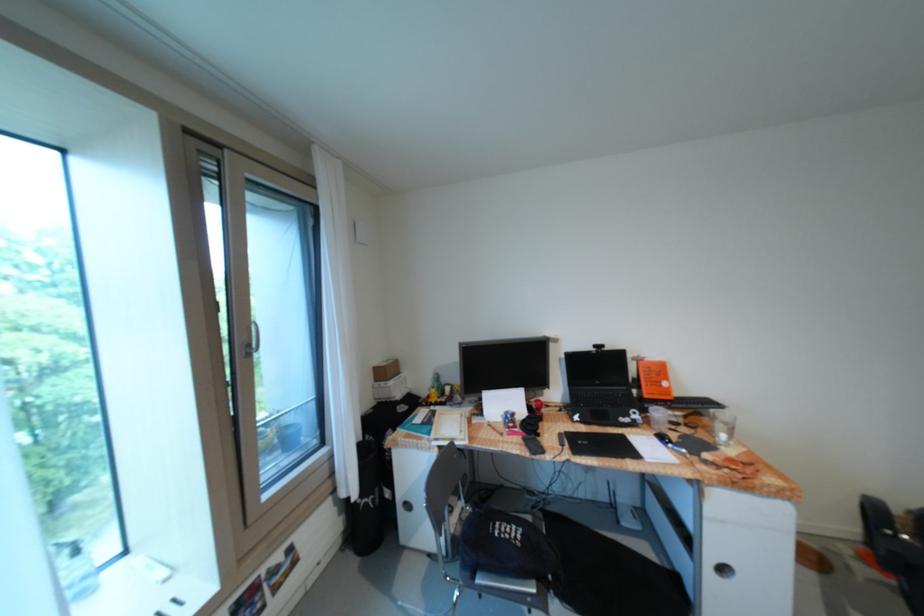
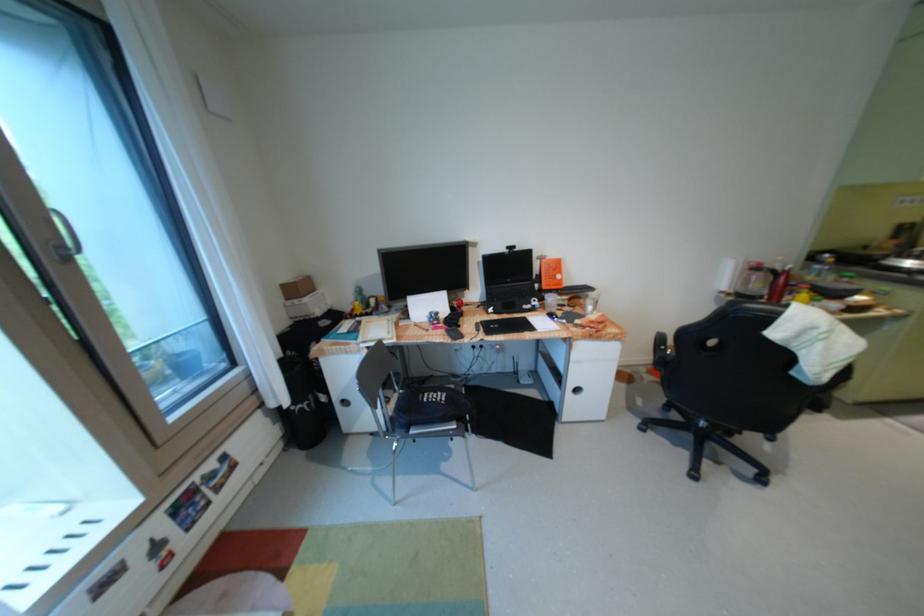
Question: I am providing you with two images of the same scene from different viewpoints. Please identify which objects are invisible in image2.

Choices:
 (A) electric kettle
 (B) black chair armrest
 (C) white cabinet handle
 (D) none of these

Answer: (D)